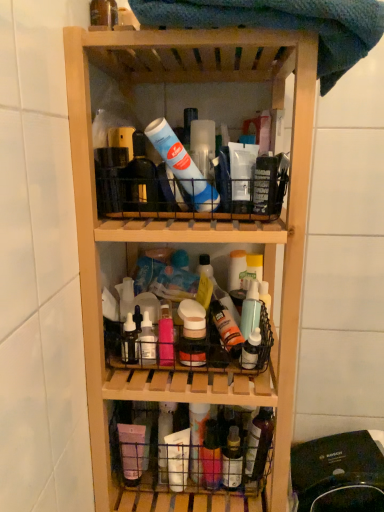
Question: Is white matte bottle at center, which ranks as the fourth bottle in top-to-bottom order, turned away from translucent plastic bottle at upper left, marked as the fifth bottle in a bottom-to-top arrangement?

Choices:
 (A) yes
 (B) no

Answer: (B)

Question: Are white matte bottle at center, positioned as the second bottle in left-to-right order, and translucent plastic bottle at upper left, positioned as the first bottle in left-to-right order, far apart?

Choices:
 (A) yes
 (B) no

Answer: (B)

Question: Is white matte bottle at center, positioned as the second bottle in left-to-right order, aimed at translucent plastic bottle at upper left, marked as the fifth bottle in a bottom-to-top arrangement?

Choices:
 (A) yes
 (B) no

Answer: (B)

Question: Does white matte bottle at center, positioned as the second bottle in left-to-right order, have a lesser height compared to translucent plastic bottle at upper left, marked as the fifth bottle in a bottom-to-top arrangement?

Choices:
 (A) yes
 (B) no

Answer: (B)

Question: Can you confirm if white matte bottle at center, arranged as the 4th bottle when viewed from the right, is smaller than translucent plastic bottle at upper left, which is the 5th bottle from right to left?

Choices:
 (A) yes
 (B) no

Answer: (B)

Question: From the image's perspective, is white matte bottle at center, which ranks as the fourth bottle in top-to-bottom order, above translucent plastic bottle at upper left, the first bottle from the top?

Choices:
 (A) no
 (B) yes

Answer: (A)

Question: Does blue textured towel at upper center have a greater height compared to natural wood shelf at center?

Choices:
 (A) yes
 (B) no

Answer: (B)

Question: Does blue textured towel at upper center contain natural wood shelf at center?

Choices:
 (A) yes
 (B) no

Answer: (B)

Question: Is blue textured towel at upper center closer to camera compared to natural wood shelf at center?

Choices:
 (A) yes
 (B) no

Answer: (A)

Question: Are blue textured towel at upper center and natural wood shelf at center making contact?

Choices:
 (A) no
 (B) yes

Answer: (A)

Question: Is blue textured towel at upper center not inside natural wood shelf at center?

Choices:
 (A) no
 (B) yes

Answer: (A)

Question: Is blue textured towel at upper center smaller than natural wood shelf at center?

Choices:
 (A) yes
 (B) no

Answer: (A)

Question: From the image's perspective, is translucent plastic spray bottle at center, which appears as the fifth bottle when viewed from the left, under translucent plastic basket at lower center?

Choices:
 (A) yes
 (B) no

Answer: (B)